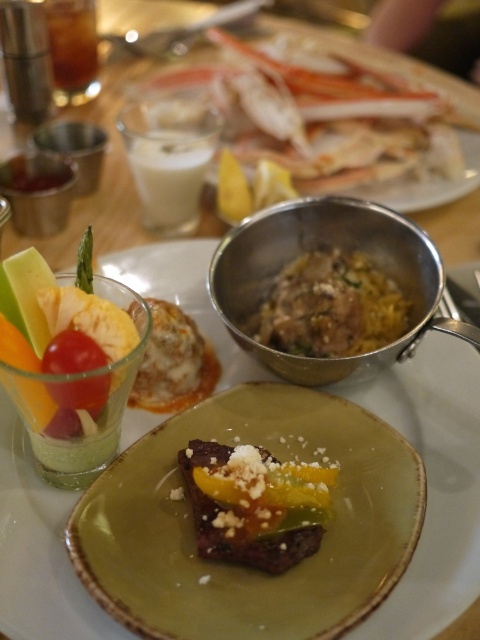
Does saucy bread at center appear over white creamy milk at center?

No, saucy bread at center is not above white creamy milk at center.

Which of these two, saucy bread at center or white creamy milk at center, stands taller?

white creamy milk at center

What do you see at coordinates (173, 362) in the screenshot?
I see `saucy bread at center` at bounding box center [173, 362].

Identify the location of saucy bread at center. The width and height of the screenshot is (480, 640). (173, 362).

Is point (372, 342) farther from camera compared to point (176, 225)?

That is False.

Image resolution: width=480 pixels, height=640 pixels. I want to click on yellow rice at center, so click(x=331, y=307).

Between white creamy milk at center and brown translucent glass at upper left, which one has more height?

white creamy milk at center is taller.

Between point (146, 136) and point (58, 22), which one is positioned in front?

Point (146, 136) is more forward.

Locate an element on the screen. The width and height of the screenshot is (480, 640). white creamy milk at center is located at coordinates 169,179.